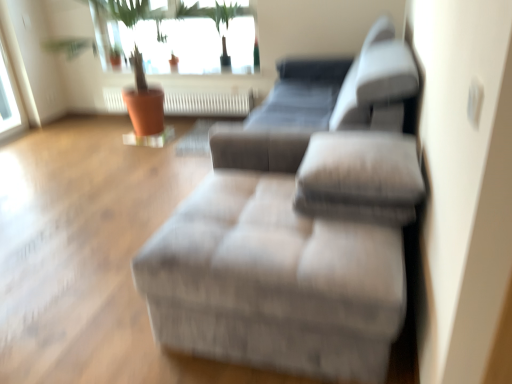
Question: Relative to silver metallic radiator at center, is textured gray ottoman at center in front or behind?

Choices:
 (A) front
 (B) behind

Answer: (A)

Question: Is textured gray ottoman at center inside the boundaries of silver metallic radiator at center, or outside?

Choices:
 (A) outside
 (B) inside

Answer: (A)

Question: Which of these objects is positioned farthest from the white glass window at upper left, which is the 2th window from right to left?

Choices:
 (A) textured gray ottoman at center
 (B) silver metallic radiator at center
 (C) transparent glass window at upper center, acting as the 1th window starting from the right

Answer: (A)

Question: Estimate the real-world distances between objects in this image. Which object is farther from the white glass window at upper left, which is the 2th window from right to left?

Choices:
 (A) transparent glass window at upper center, acting as the 1th window starting from the right
 (B) silver metallic radiator at center
 (C) textured gray ottoman at center

Answer: (C)